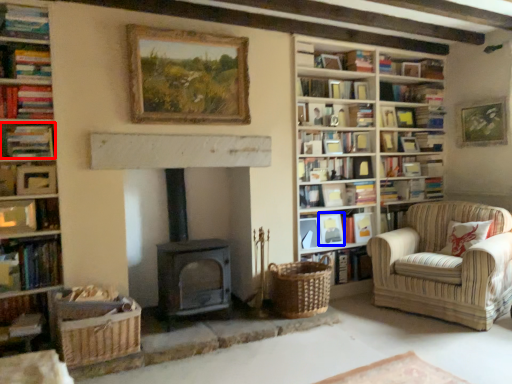
Question: Which object is further to the camera taking this photo, book (highlighted by a red box) or picture frame (highlighted by a blue box)?

Choices:
 (A) book
 (B) picture frame

Answer: (B)